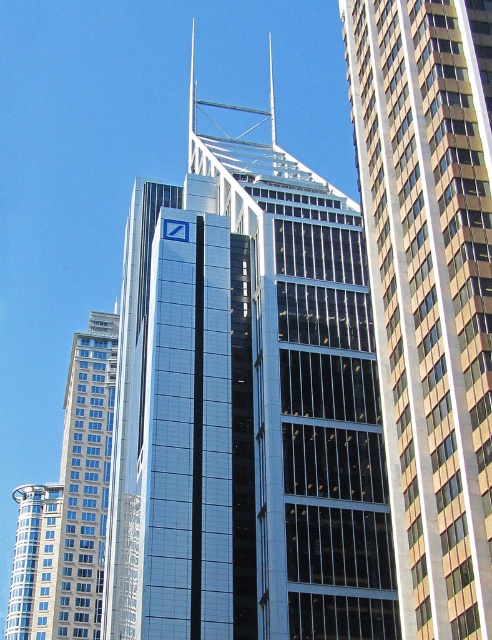
Is shiny glass skyscraper at center to the left of silver glass building at left from the viewer's perspective?

In fact, shiny glass skyscraper at center is to the right of silver glass building at left.

Is point (334, 509) positioned before point (98, 584)?

Yes, point (334, 509) is in front of point (98, 584).

Where is `shiny glass skyscraper at center`? The image size is (492, 640). shiny glass skyscraper at center is located at coordinates (246, 406).

Between silver glass building at left and silver glass tower at lower left, which one appears on the right side from the viewer's perspective?

silver glass building at left is more to the right.

Does silver glass building at left have a larger size compared to silver glass tower at lower left?

No, silver glass building at left is not bigger than silver glass tower at lower left.

Is point (83, 579) farther from camera compared to point (24, 604)?

No, it is not.

Image resolution: width=492 pixels, height=640 pixels. I want to click on silver glass building at left, so click(86, 476).

Who is taller, reflective glass skyscraper at right or silver glass tower at lower left?

Standing taller between the two is reflective glass skyscraper at right.

Consider the image. Which of these two, reflective glass skyscraper at right or silver glass tower at lower left, stands shorter?

silver glass tower at lower left

Between point (460, 49) and point (33, 552), which one is positioned in front?

Point (460, 49)

Locate an element on the screen. This screenshot has width=492, height=640. reflective glass skyscraper at right is located at coordinates (430, 291).